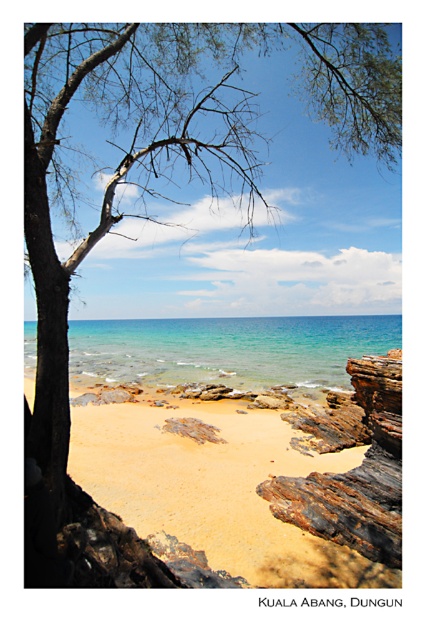
Question: Based on their relative distances, which object is nearer to the golden sand beach at center?

Choices:
 (A) clear blue water at center
 (B) rusty wood rock at lower right

Answer: (B)

Question: Which object appears closest to the camera in this image?

Choices:
 (A) clear blue water at center
 (B) rusty wood rock at lower right

Answer: (B)

Question: Among these objects, which one is farthest from the camera?

Choices:
 (A) golden sand beach at center
 (B) clear blue water at center
 (C) rusty wood rock at lower right

Answer: (B)

Question: Can you confirm if golden sand beach at center is positioned to the left of rusty wood rock at lower right?

Choices:
 (A) yes
 (B) no

Answer: (A)

Question: Is golden sand beach at center behind rusty wood rock at lower right?

Choices:
 (A) yes
 (B) no

Answer: (B)

Question: Does golden sand beach at center appear under rusty wood rock at lower right?

Choices:
 (A) no
 (B) yes

Answer: (B)